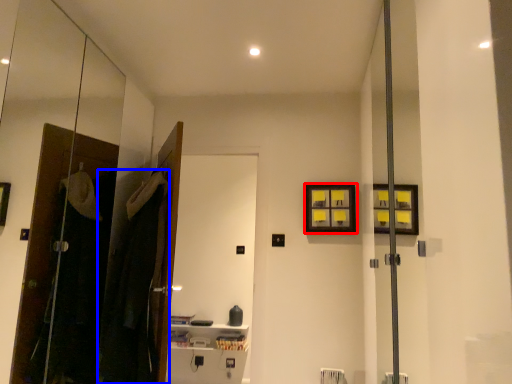
Question: Among these objects, which one is nearest to the camera, picture frame (highlighted by a red box) or laundry (highlighted by a blue box)?

Choices:
 (A) picture frame
 (B) laundry

Answer: (B)